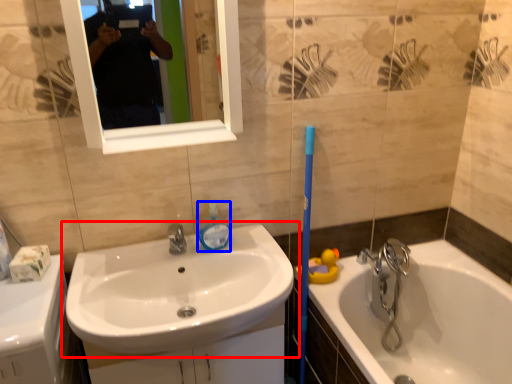
Question: Which object appears closest to the camera in this image, sink (highlighted by a red box) or soap dispenser (highlighted by a blue box)?

Choices:
 (A) sink
 (B) soap dispenser

Answer: (A)